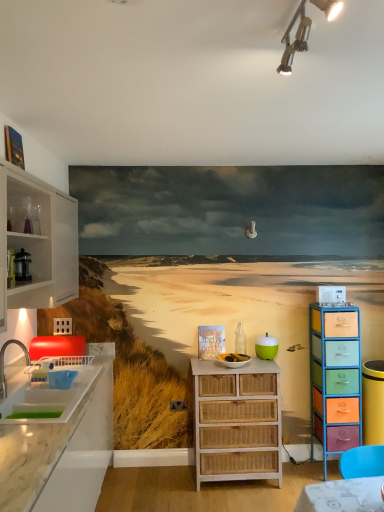
Question: Visually, is white wicker chest of drawers at center, acting as the first chest of drawers starting from the left, positioned to the left or to the right of green matte apple at center?

Choices:
 (A) left
 (B) right

Answer: (A)

Question: Is white wicker chest of drawers at center, positioned as the second chest of drawers in right-to-left order, taller or shorter than green matte apple at center?

Choices:
 (A) short
 (B) tall

Answer: (B)

Question: Estimate the real-world distances between objects in this image. Which object is closer to the white glossy sink at left?

Choices:
 (A) white plastic microwave at upper right, which is the 1th appliance from right to left
 (B) white wicker basket at center, which is the second appliance from right to left
 (C) green matte apple at center
 (D) metallic silver coffee pot at left, arranged as the 3th appliance when viewed from the right
 (E) metallic track lighting at upper center

Answer: (D)

Question: Which object is positioned closest to the white glass cabinet at left?

Choices:
 (A) marble countertop at left
 (B) white wicker chest of drawers at center, positioned as the second chest of drawers in right-to-left order
 (C) metallic silver coffee pot at left, which is the 3th appliance from back to front
 (D) metallic track lighting at upper center
 (E) white glossy sink at left

Answer: (C)